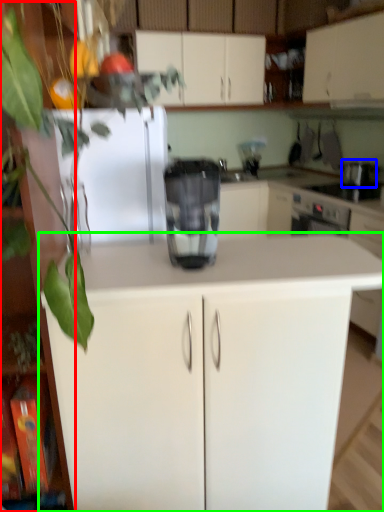
Question: Which is nearer to the cabinetry (highlighted by a red box)? appliance (highlighted by a blue box) or cabinetry (highlighted by a green box).

Choices:
 (A) appliance
 (B) cabinetry

Answer: (B)